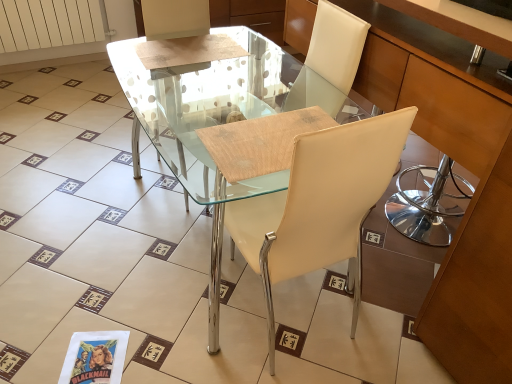
Question: Is white matte radiator at upper left located within transparent glass table at center?

Choices:
 (A) no
 (B) yes

Answer: (A)

Question: Is transparent glass table at center to the left of white matte radiator at upper left from the viewer's perspective?

Choices:
 (A) yes
 (B) no

Answer: (B)

Question: Would you consider transparent glass table at center to be distant from white matte radiator at upper left?

Choices:
 (A) no
 (B) yes

Answer: (B)

Question: Is transparent glass table at center to the right of white matte radiator at upper left from the viewer's perspective?

Choices:
 (A) yes
 (B) no

Answer: (A)

Question: From a real-world perspective, does transparent glass table at center sit lower than white matte radiator at upper left?

Choices:
 (A) no
 (B) yes

Answer: (A)

Question: Is the position of transparent glass table at center less distant than that of white matte radiator at upper left?

Choices:
 (A) yes
 (B) no

Answer: (A)

Question: Is transparent glass table at center inside white matte radiator at upper left?

Choices:
 (A) yes
 (B) no

Answer: (B)

Question: From the image's perspective, would you say white matte radiator at upper left is positioned over transparent glass table at center?

Choices:
 (A) yes
 (B) no

Answer: (A)

Question: Are white matte radiator at upper left and transparent glass table at center beside each other?

Choices:
 (A) yes
 (B) no

Answer: (B)

Question: Is the depth of white matte radiator at upper left less than that of transparent glass table at center?

Choices:
 (A) yes
 (B) no

Answer: (B)

Question: Does white matte radiator at upper left have a lesser width compared to transparent glass table at center?

Choices:
 (A) no
 (B) yes

Answer: (B)

Question: Is white matte radiator at upper left not near transparent glass table at center?

Choices:
 (A) yes
 (B) no

Answer: (A)

Question: Is transparent glass table at center positioned with its back to matte wood cabinet at center?

Choices:
 (A) no
 (B) yes

Answer: (B)